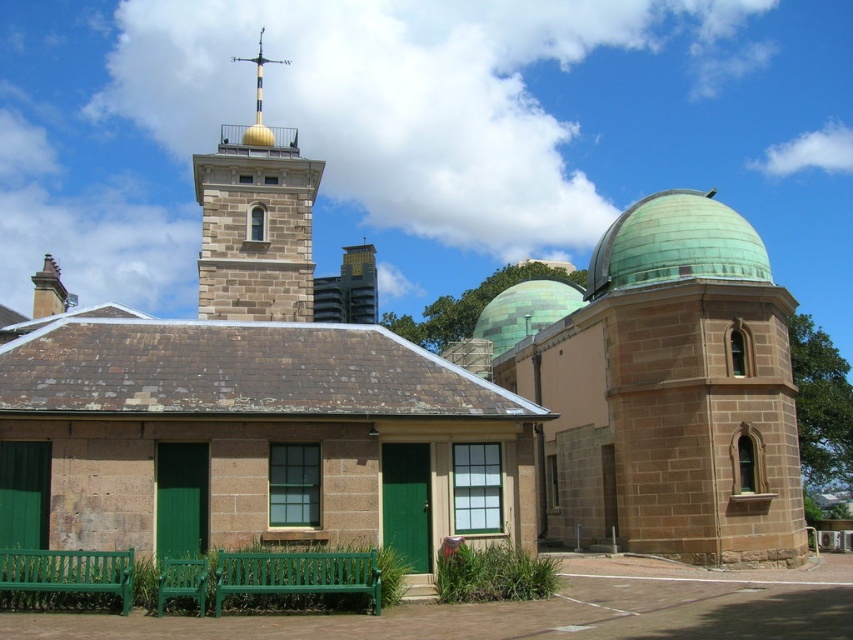
Question: Among these points, which one is farthest from the camera?

Choices:
 (A) (468, 410)
 (B) (107, 579)
 (C) (370, 273)

Answer: (C)

Question: Which is nearer to the green wooden bench at lower center?

Choices:
 (A) gold polished metal spire at upper center
 (B) stone weather vane at upper center
 (C) green polished dome at center
 (D) green stone dome at upper right

Answer: (D)

Question: Can you confirm if green wooden bench at lower center is thinner than green polished dome at center?

Choices:
 (A) yes
 (B) no

Answer: (A)

Question: Is green glass dome at center right positioned behind green plastic bench at lower center?

Choices:
 (A) yes
 (B) no

Answer: (A)

Question: Can you confirm if brown stone chapel at center is positioned above green glass dome at center right?

Choices:
 (A) no
 (B) yes

Answer: (B)

Question: Based on their relative distances, which object is nearer to the gold metallic tower at upper center?

Choices:
 (A) green stone dome at upper right
 (B) green glass dome at center right
 (C) stone weather vane at upper center

Answer: (A)